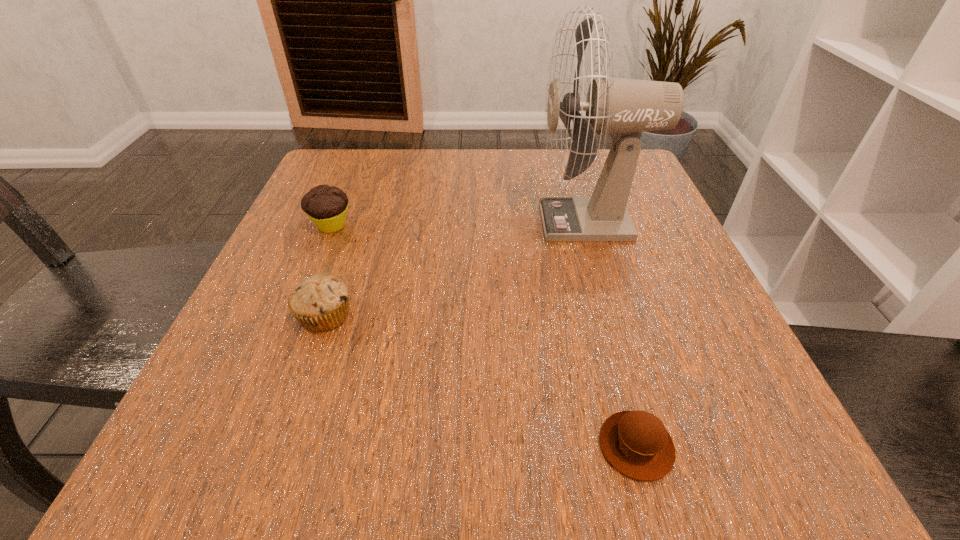
The height and width of the screenshot is (540, 960). What are the coordinates of `vacant region located on the back of the nearest muffin` in the screenshot? It's located at (583, 247).

The width and height of the screenshot is (960, 540). Identify the location of object at the far edge. (625, 107).

The width and height of the screenshot is (960, 540). Identify the location of object present at the near edge. (636, 443).

Locate an element on the screen. The height and width of the screenshot is (540, 960). fan that is at the right edge is located at coordinates (625, 107).

Find the location of a particular element. Image resolution: width=960 pixels, height=540 pixels. muffin at the right edge is located at coordinates (636, 443).

Locate an element on the screen. The width and height of the screenshot is (960, 540). object that is at the far right corner is located at coordinates (625, 107).

I want to click on object present at the near right corner, so tap(636, 443).

Find the location of a particular element. Image resolution: width=960 pixels, height=540 pixels. vacant space at the far edge of the desktop is located at coordinates (396, 183).

In the image, there is a desktop. Where is `vacant space at the near edge`? The image size is (960, 540). vacant space at the near edge is located at coordinates (355, 422).

I want to click on vacant region at the left edge, so click(291, 260).